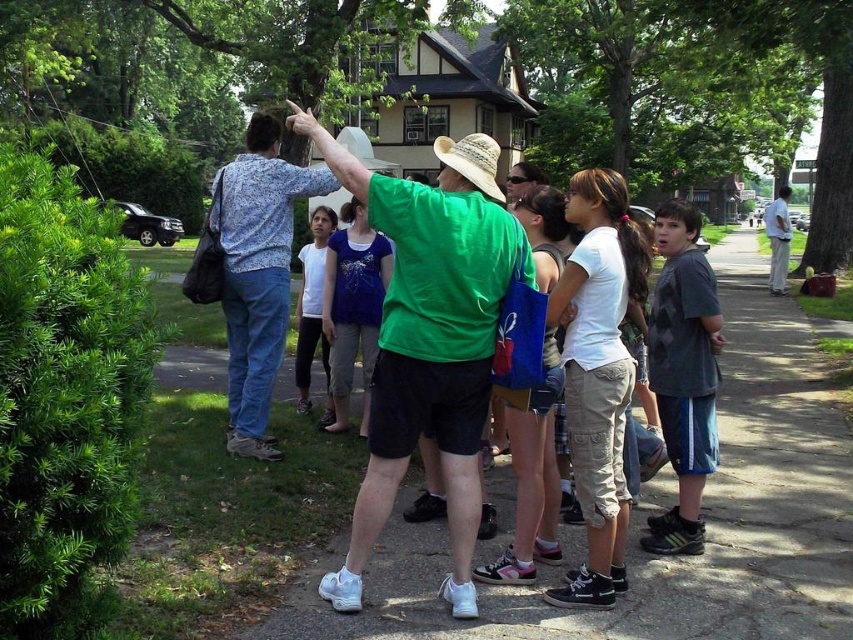
You are a photographer trying to capture both the straw cowboy hat at center and the straw hat at center in a single shot. Which hat should you focus on first if you want to ensure both are in frame without moving the camera?

The straw cowboy hat at center is smaller than the straw hat at center, so you should focus on the straw hat at center first to ensure it fits within the frame since it is larger and might require more space.

You are standing at point (x=486, y=141) and want to walk to the house in the background. Is the point (x=347, y=600) in your way?

Point (x=347, y=600) is in front of point (x=486, y=141), so yes, it will be in your way when walking to the house.